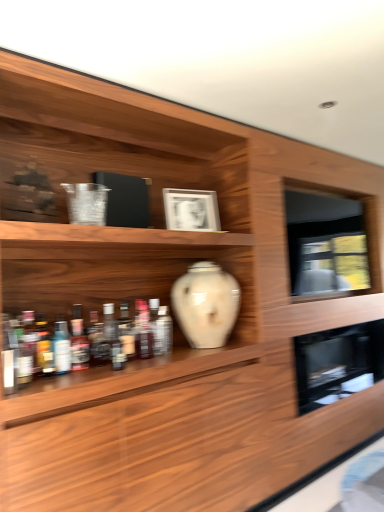
Question: Which direction should I rotate to face translucent glass bottles at shelf center, which is the eighth bottle from front to back, — up or down?

Choices:
 (A) up
 (B) down

Answer: (B)

Question: Is translucent glass bottles at shelf center, the fourth bottle from the back, oriented away from translucent glass bottle at center, the tenth bottle positioned from the front?

Choices:
 (A) yes
 (B) no

Answer: (B)

Question: From a real-world perspective, is translucent glass bottles at shelf center, which is the eighth bottle from front to back, located higher than translucent glass bottle at center, the tenth bottle positioned from the front?

Choices:
 (A) no
 (B) yes

Answer: (B)

Question: Does translucent glass bottles at shelf center, the fourth bottle from the back, appear on the right side of translucent glass bottle at center, the second bottle when ordered from back to front?

Choices:
 (A) yes
 (B) no

Answer: (A)

Question: Is translucent glass bottles at shelf center, which is the eighth bottle from front to back, completely or partially outside of translucent glass bottle at center, the second bottle when ordered from back to front?

Choices:
 (A) no
 (B) yes

Answer: (B)

Question: Are translucent glass bottles at shelf center, which is the eighth bottle from front to back, and translucent glass bottle at center, the second bottle when ordered from back to front, beside each other?

Choices:
 (A) yes
 (B) no

Answer: (B)

Question: Does translucent glass bottles at shelf center, the fourth bottle from the back, have a larger size compared to translucent glass bottle at center, the second bottle when ordered from back to front?

Choices:
 (A) yes
 (B) no

Answer: (B)

Question: Can you confirm if translucent glass bottles at left, which ranks as the tenth bottle in back-to-front order, is shorter than translucent plastic bottle at left, the ninth bottle when ordered from back to front?

Choices:
 (A) no
 (B) yes

Answer: (A)

Question: Considering the relative sizes of translucent glass bottles at left, which ranks as the tenth bottle in back-to-front order, and translucent plastic bottle at left, the ninth bottle when ordered from back to front, in the image provided, is translucent glass bottles at left, which ranks as the tenth bottle in back-to-front order, thinner than translucent plastic bottle at left, the ninth bottle when ordered from back to front,?

Choices:
 (A) no
 (B) yes

Answer: (A)

Question: Considering the relative positions of translucent glass bottles at left, which ranks as the tenth bottle in back-to-front order, and translucent plastic bottle at left, which is the 3th bottle in front-to-back order, in the image provided, is translucent glass bottles at left, which ranks as the tenth bottle in back-to-front order, to the right of translucent plastic bottle at left, which is the 3th bottle in front-to-back order, from the viewer's perspective?

Choices:
 (A) no
 (B) yes

Answer: (A)

Question: Are translucent glass bottles at left, which ranks as the tenth bottle in back-to-front order, and translucent plastic bottle at left, which is the 3th bottle in front-to-back order, far apart?

Choices:
 (A) no
 (B) yes

Answer: (A)

Question: Considering the relative sizes of translucent glass bottles at left, which ranks as the tenth bottle in back-to-front order, and translucent plastic bottle at left, which is the 3th bottle in front-to-back order, in the image provided, is translucent glass bottles at left, which ranks as the tenth bottle in back-to-front order, wider than translucent plastic bottle at left, which is the 3th bottle in front-to-back order,?

Choices:
 (A) yes
 (B) no

Answer: (A)

Question: Is translucent glass bottles at left, which is the second bottle from front to back, facing away from translucent plastic bottle at left, which is the 3th bottle in front-to-back order?

Choices:
 (A) yes
 (B) no

Answer: (B)

Question: From the image's perspective, does translucent glass bottle at left, which is counted as the 7th bottle, starting from the front, appear lower than white matte picture frame at upper center?

Choices:
 (A) yes
 (B) no

Answer: (A)